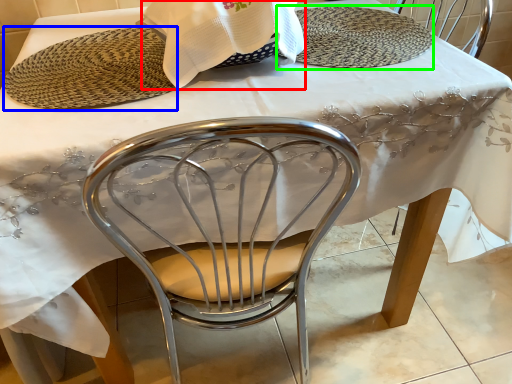
Question: Considering the real-world distances, which object is farthest from blanket (highlighted by a red box)? platter (highlighted by a blue box) or plate (highlighted by a green box)?

Choices:
 (A) platter
 (B) plate

Answer: (B)